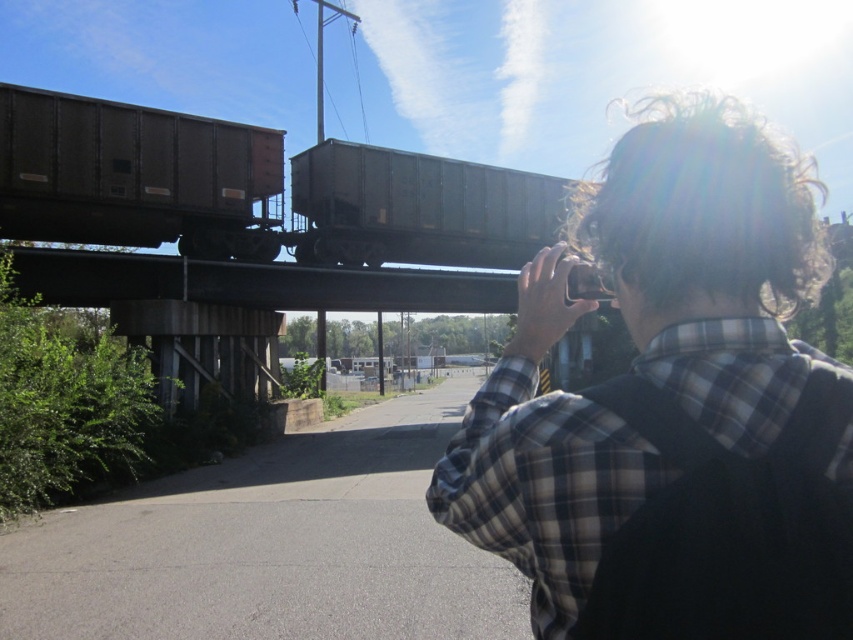
Question: Which of the following is the farthest from the observer?

Choices:
 (A) plaid shirt at upper right
 (B) dark gray metal train car at upper center
 (C) brown matte train car at left

Answer: (B)

Question: Can you confirm if plaid shirt at upper right is smaller than brown matte train car at left?

Choices:
 (A) yes
 (B) no

Answer: (B)

Question: Is plaid shirt at upper right to the right of brown matte train car at left from the viewer's perspective?

Choices:
 (A) yes
 (B) no

Answer: (A)

Question: Is the position of plaid shirt at upper right less distant than that of brown matte train car at left?

Choices:
 (A) yes
 (B) no

Answer: (A)

Question: Considering the real-world distances, which object is farthest from the brown matte train car at left?

Choices:
 (A) plaid shirt at upper right
 (B) dark gray metal train car at upper center

Answer: (A)

Question: Estimate the real-world distances between objects in this image. Which object is closer to the dark gray metal train car at upper center?

Choices:
 (A) plaid shirt at upper right
 (B) brown matte train car at left

Answer: (B)